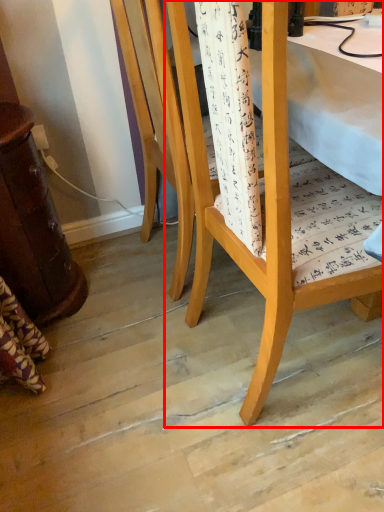
Question: Observing the image, what is the correct spatial positioning of chair (annotated by the red box) in reference to chair?

Choices:
 (A) left
 (B) right

Answer: (B)